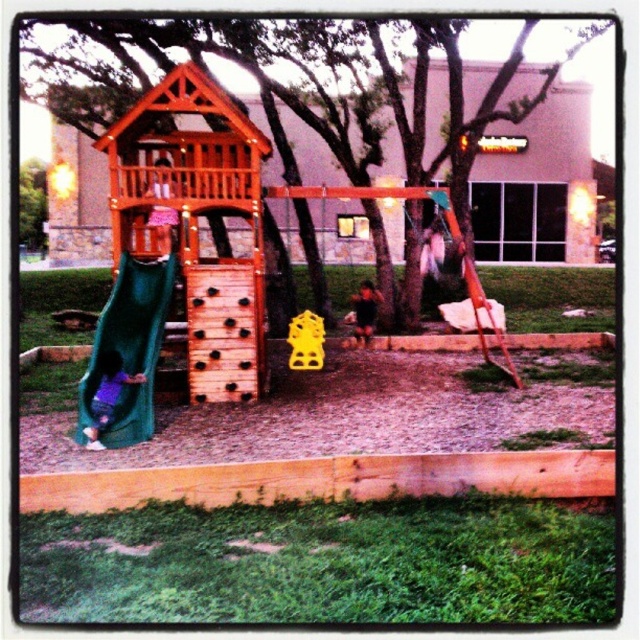
Does point (148, 368) lie in front of point (96, 424)?

No, (148, 368) is further to viewer.

Is green fabric slide at left to the left of purple fabric slide at lower left from the viewer's perspective?

Yes, green fabric slide at left is to the left of purple fabric slide at lower left.

The height and width of the screenshot is (640, 640). Find the location of `green fabric slide at left`. green fabric slide at left is located at coordinates (129, 348).

I want to click on purple fabric slide at lower left, so click(108, 396).

Is green fabric slide at left positioned behind dark brown hair at center?

No, green fabric slide at left is in front of dark brown hair at center.

Does green fabric slide at left appear on the left side of dark brown hair at center?

Yes, green fabric slide at left is to the left of dark brown hair at center.

Which is behind, point (116, 339) or point (372, 324)?

Point (372, 324)

Where is `green fabric slide at left`? green fabric slide at left is located at coordinates (129, 348).